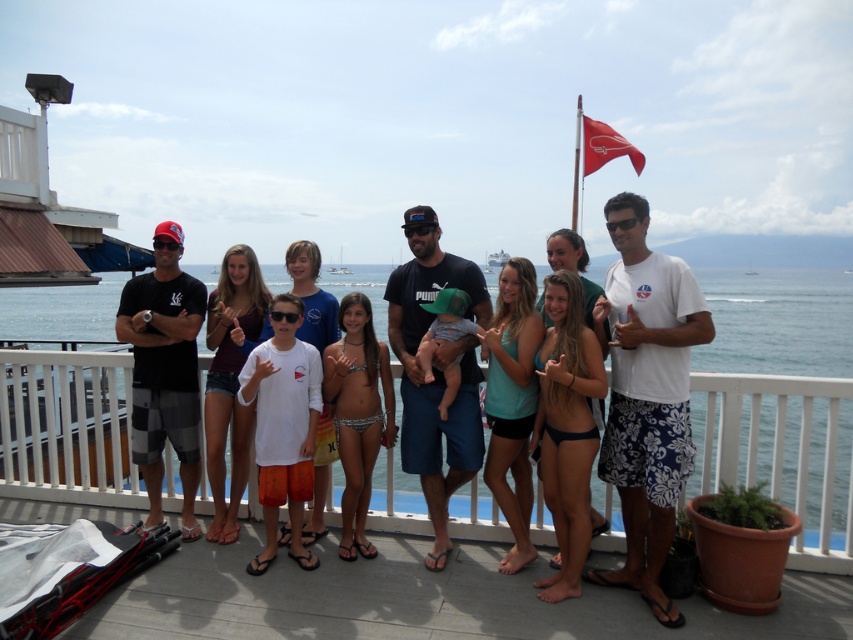
Question: Considering the real-world distances, which object is farthest from the smooth wooden deck at lower center?

Choices:
 (A) white matte shirt at center
 (B) white wooden porch at center
 (C) white cotton t-shirt at center
 (D) maroon jersey at center

Answer: (B)

Question: Based on their relative distances, which object is nearer to the maroon jersey at center?

Choices:
 (A) white printed bikini at center
 (B) red fabric flag at upper center

Answer: (A)

Question: Which object is farther from the camera taking this photo?

Choices:
 (A) white matte shirt at center
 (B) red fabric flag at upper center
 (C) white printed bikini at center

Answer: (B)

Question: Observing the image, what is the correct spatial positioning of white wooden porch at center in reference to white printed bikini at center?

Choices:
 (A) below
 (B) above

Answer: (A)

Question: Does smooth wooden deck at lower center have a greater width compared to white printed bikini at center?

Choices:
 (A) yes
 (B) no

Answer: (A)

Question: Does smooth wooden deck at lower center have a lesser width compared to white wooden porch at center?

Choices:
 (A) yes
 (B) no

Answer: (B)